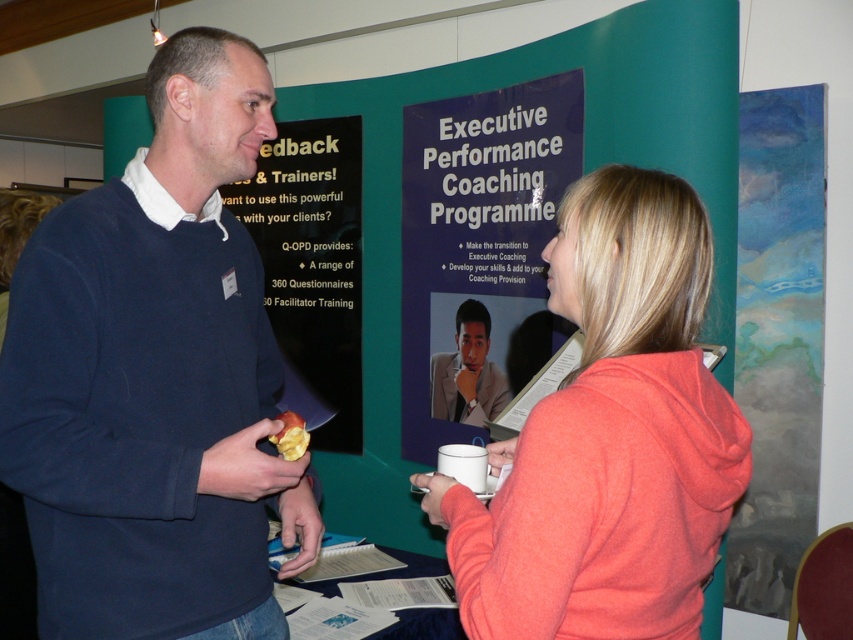
Question: Is dark blue sweater at center bigger than yellow matte apple at center?

Choices:
 (A) no
 (B) yes

Answer: (B)

Question: Which point is farther from the camera taking this photo?

Choices:
 (A) (788, 476)
 (B) (292, 458)
 (C) (108, 337)
 (D) (276, 285)

Answer: (D)

Question: Among these points, which one is farthest from the camera?

Choices:
 (A) coord(190,614)
 (B) coord(778,172)
 (C) coord(576,227)
 (D) coord(407,448)

Answer: (D)

Question: Is black glossy poster at center positioned before yellow matte apple at center?

Choices:
 (A) yes
 (B) no

Answer: (B)

Question: Which point is farther to the camera?

Choices:
 (A) (525, 353)
 (B) (672, 392)

Answer: (A)

Question: In this image, where is blue paper poster at center located relative to yellow matte apple at center?

Choices:
 (A) right
 (B) left

Answer: (A)